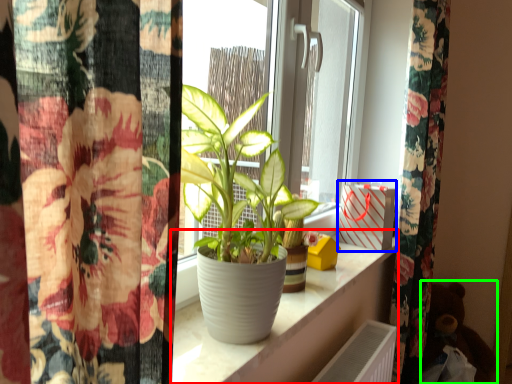
Question: Considering the real-world distances, which object is closest to window sill (highlighted by a red box)? window box (highlighted by a blue box) or toy (highlighted by a green box).

Choices:
 (A) window box
 (B) toy

Answer: (A)